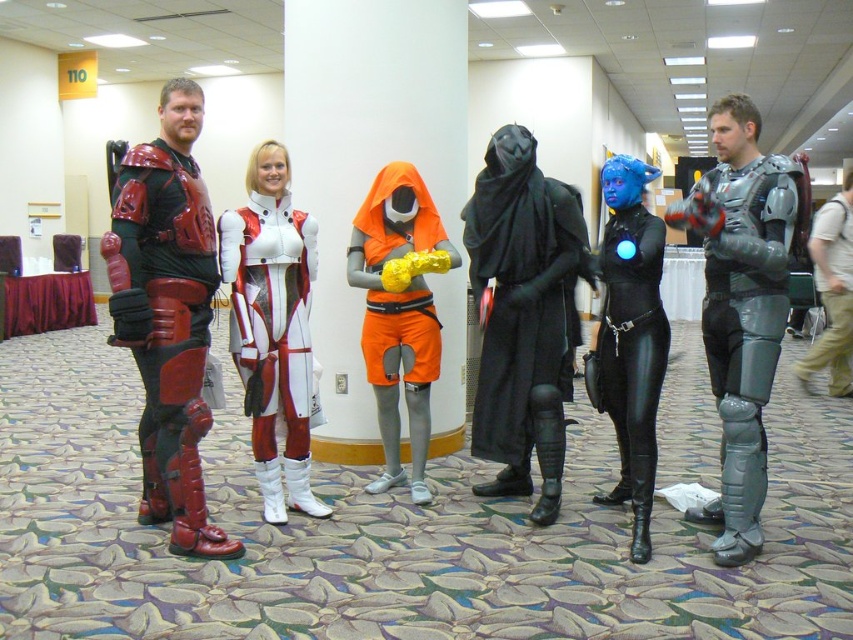
Who is positioned more to the left, metallic silver armor at right or orange matte shorts at center?

orange matte shorts at center

Is metallic silver armor at right wider than orange matte shorts at center?

Yes, metallic silver armor at right is wider than orange matte shorts at center.

Which is in front, point (772, 157) or point (368, 227)?

Positioned in front is point (772, 157).

Find the location of `metallic silver armor at right`. metallic silver armor at right is located at coordinates (744, 314).

Locate an element on the screen. shiny red armor at left is located at coordinates (163, 314).

Can you confirm if shiny red armor at left is positioned below black leather bodysuit at center?

Incorrect, shiny red armor at left is not positioned below black leather bodysuit at center.

Who is more distant from viewer, (138,330) or (621,404)?

Point (621,404)

Find the location of a particular element. shiny red armor at left is located at coordinates (163, 314).

Is black leather bodysuit at center to the right of gray metallic armor at right from the viewer's perspective?

No, black leather bodysuit at center is not to the right of gray metallic armor at right.

How far apart are black leather bodysuit at center and gray metallic armor at right?

The distance of black leather bodysuit at center from gray metallic armor at right is 3.29 meters.

Where is `black leather bodysuit at center`? black leather bodysuit at center is located at coordinates (631, 346).